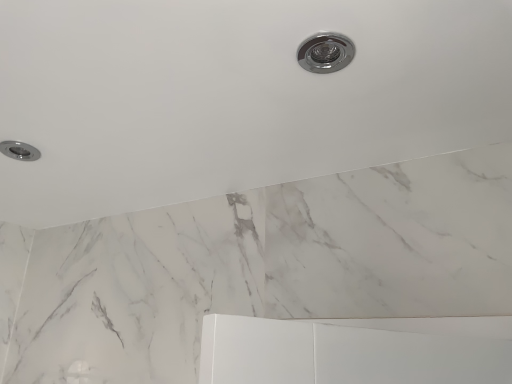
Image resolution: width=512 pixels, height=384 pixels. Describe the element at coordinates (325, 52) in the screenshot. I see `chrome/metallic recessed light at upper center` at that location.

This screenshot has width=512, height=384. I want to click on chrome/metallic recessed light at upper center, so click(x=325, y=52).

What do you see at coordinates (19, 150) in the screenshot? The height and width of the screenshot is (384, 512). I see `satin chrome light fixture at upper left` at bounding box center [19, 150].

The image size is (512, 384). What are the coordinates of `satin chrome light fixture at upper left` in the screenshot? It's located at (19, 150).

Where is `chrome/metallic recessed light at upper center`? Image resolution: width=512 pixels, height=384 pixels. chrome/metallic recessed light at upper center is located at coordinates (325, 52).

Does satin chrome light fixture at upper left appear on the left side of chrome/metallic recessed light at upper center?

Yes.

Considering the relative positions of satin chrome light fixture at upper left and chrome/metallic recessed light at upper center in the image provided, is satin chrome light fixture at upper left in front of chrome/metallic recessed light at upper center?

No, satin chrome light fixture at upper left is further to the viewer.

Which point is more distant from viewer, [25,154] or [327,56]?

The point [25,154] is more distant.

From the image's perspective, is satin chrome light fixture at upper left located above chrome/metallic recessed light at upper center?

No.

From a real-world perspective, is satin chrome light fixture at upper left on chrome/metallic recessed light at upper center?

Yes, from a real-world perspective, satin chrome light fixture at upper left is above chrome/metallic recessed light at upper center.

Which object is wider, satin chrome light fixture at upper left or chrome/metallic recessed light at upper center?

With larger width is satin chrome light fixture at upper left.

From their relative heights in the image, would you say satin chrome light fixture at upper left is taller or shorter than chrome/metallic recessed light at upper center?

In the image, satin chrome light fixture at upper left appears to be taller than chrome/metallic recessed light at upper center.

Does satin chrome light fixture at upper left have a larger size compared to chrome/metallic recessed light at upper center?

Yes.

Is chrome/metallic recessed light at upper center inside satin chrome light fixture at upper left?

No.

Is satin chrome light fixture at upper left in contact with chrome/metallic recessed light at upper center?

No, satin chrome light fixture at upper left is not touching chrome/metallic recessed light at upper center.

Is satin chrome light fixture at upper left positioned with its back to chrome/metallic recessed light at upper center?

No, satin chrome light fixture at upper left's orientation is not away from chrome/metallic recessed light at upper center.

What's the angular difference between satin chrome light fixture at upper left and chrome/metallic recessed light at upper center's facing directions?

satin chrome light fixture at upper left and chrome/metallic recessed light at upper center are facing 90 degrees away from each other.

Could you measure the distance between satin chrome light fixture at upper left and chrome/metallic recessed light at upper center?

The distance of satin chrome light fixture at upper left from chrome/metallic recessed light at upper center is 26.61 inches.

This screenshot has width=512, height=384. In order to click on knob located below the chrome/metallic recessed light at upper center (from the image's perspective) in this screenshot , I will do `click(19, 150)`.

Considering the positions of objects chrome/metallic recessed light at upper center and satin chrome light fixture at upper left in the image provided, who is more to the right, chrome/metallic recessed light at upper center or satin chrome light fixture at upper left?

chrome/metallic recessed light at upper center.

In the image, is chrome/metallic recessed light at upper center positioned in front of or behind satin chrome light fixture at upper left?

Clearly, chrome/metallic recessed light at upper center is in front of satin chrome light fixture at upper left.

Which point is more forward, (331, 66) or (16, 152)?

The point (331, 66) is more forward.

From the image's perspective, is chrome/metallic recessed light at upper center located above satin chrome light fixture at upper left?

Yes, from the image's perspective, chrome/metallic recessed light at upper center is above satin chrome light fixture at upper left.

From a real-world perspective, is chrome/metallic recessed light at upper center on satin chrome light fixture at upper left?

No, from a real-world perspective, chrome/metallic recessed light at upper center is not on top of satin chrome light fixture at upper left.

Looking at their sizes, would you say chrome/metallic recessed light at upper center is wider or thinner than satin chrome light fixture at upper left?

chrome/metallic recessed light at upper center is thinner than satin chrome light fixture at upper left.

Considering the relative sizes of chrome/metallic recessed light at upper center and satin chrome light fixture at upper left in the image provided, is chrome/metallic recessed light at upper center taller than satin chrome light fixture at upper left?

No, chrome/metallic recessed light at upper center is not taller than satin chrome light fixture at upper left.

Is chrome/metallic recessed light at upper center bigger or smaller than satin chrome light fixture at upper left?

Clearly, chrome/metallic recessed light at upper center is smaller in size than satin chrome light fixture at upper left.

Is chrome/metallic recessed light at upper center positioned beyond the bounds of satin chrome light fixture at upper left?

Yes, chrome/metallic recessed light at upper center is outside of satin chrome light fixture at upper left.

Does chrome/metallic recessed light at upper center touch satin chrome light fixture at upper left?

No, chrome/metallic recessed light at upper center is not making contact with satin chrome light fixture at upper left.

Is chrome/metallic recessed light at upper center positioned with its back to satin chrome light fixture at upper left?

No, satin chrome light fixture at upper left is not at the back of chrome/metallic recessed light at upper center.

This screenshot has height=384, width=512. What are the coordinates of `plumbing fixture below the satin chrome light fixture at upper left (from a real-world perspective)` in the screenshot? It's located at (325, 52).

This screenshot has width=512, height=384. What are the coordinates of `plumbing fixture below the satin chrome light fixture at upper left (from a real-world perspective)` in the screenshot? It's located at pyautogui.click(x=325, y=52).

Find the location of a particular element. The width and height of the screenshot is (512, 384). knob on the left of the chrome/metallic recessed light at upper center is located at coordinates tap(19, 150).